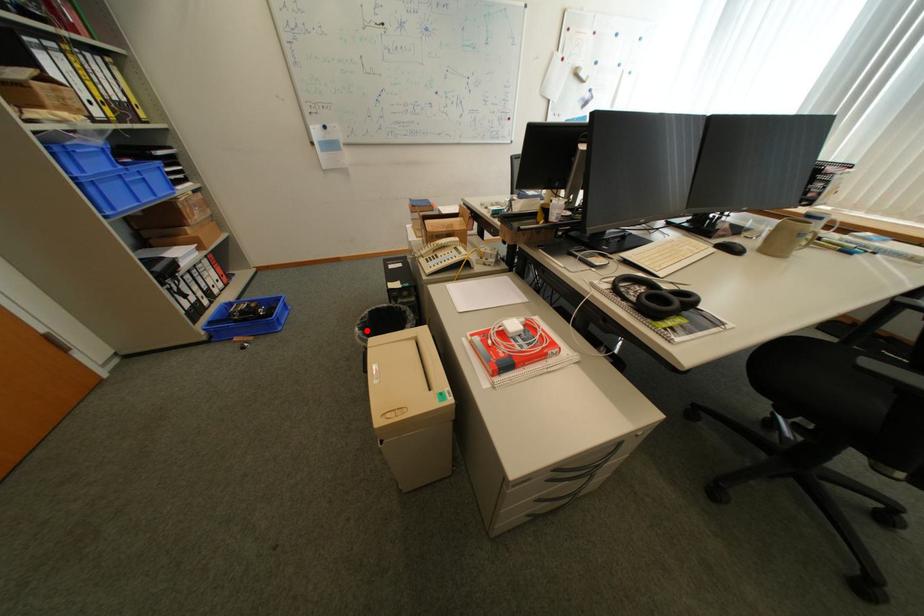
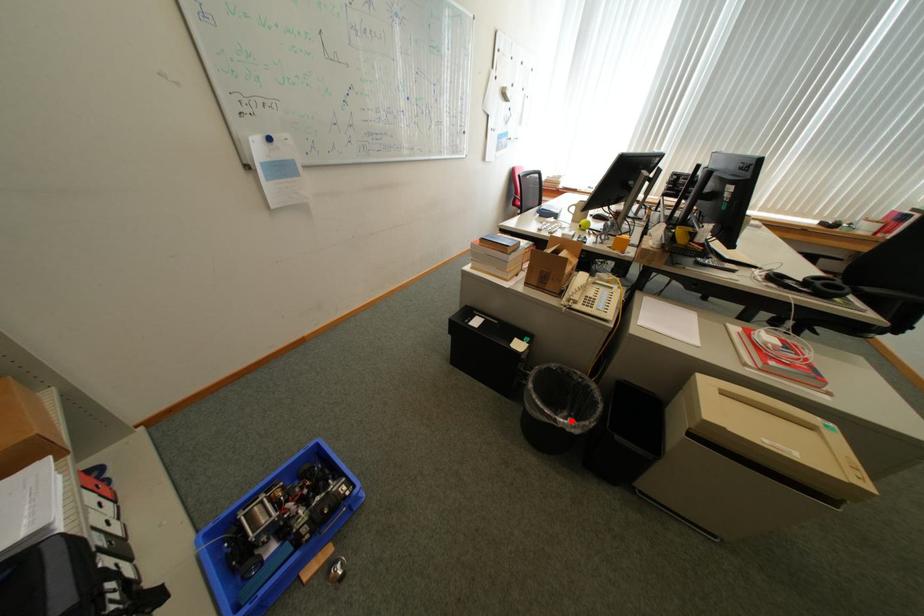
I am providing you with two images of the same scene from different viewpoints. A red point is marked on the first image and another point is marked on the second image. Are the points marked in image1 and image2 representing the same 3D position?

Yes